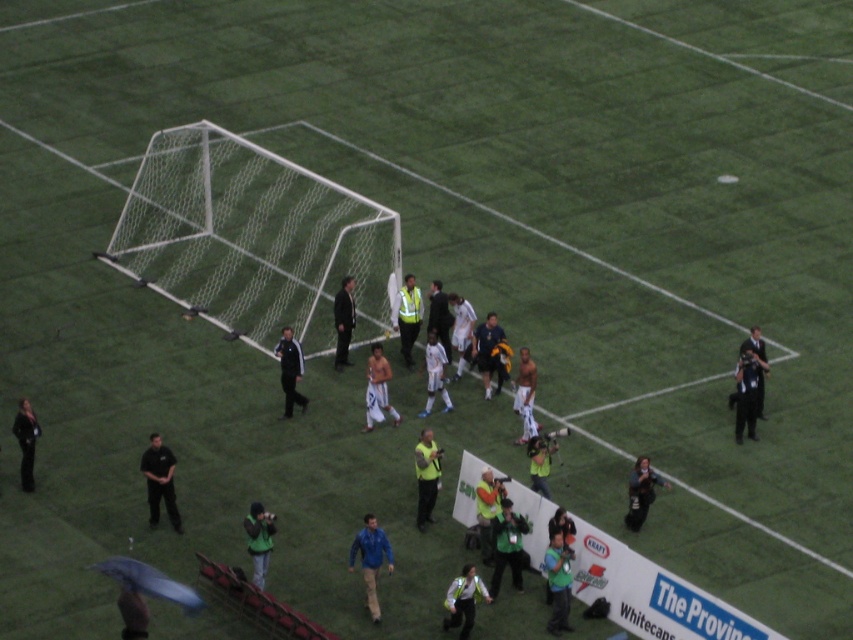
Question: Where is reflective silver vest at center located in relation to white textured shorts at center in the image?

Choices:
 (A) above
 (B) below

Answer: (B)

Question: Which point appears farthest from the camera in this image?

Choices:
 (A) (349, 326)
 (B) (550, 564)
 (C) (294, 371)
 (D) (140, 627)

Answer: (A)

Question: Is yellow reflective vest at center bigger than reflective yellow vest at center?

Choices:
 (A) no
 (B) yes

Answer: (A)

Question: Which of the following is the farthest from the observer?

Choices:
 (A) black leather jacket at lower left
 (B) yellow matte vest at center

Answer: (A)

Question: Is green matte jacket at center below skinny man at center?

Choices:
 (A) yes
 (B) no

Answer: (A)

Question: Which object is closer to the camera taking this photo?

Choices:
 (A) black fabric camera at right
 (B) black leather jacket at center
 (C) dark suit at center

Answer: (A)